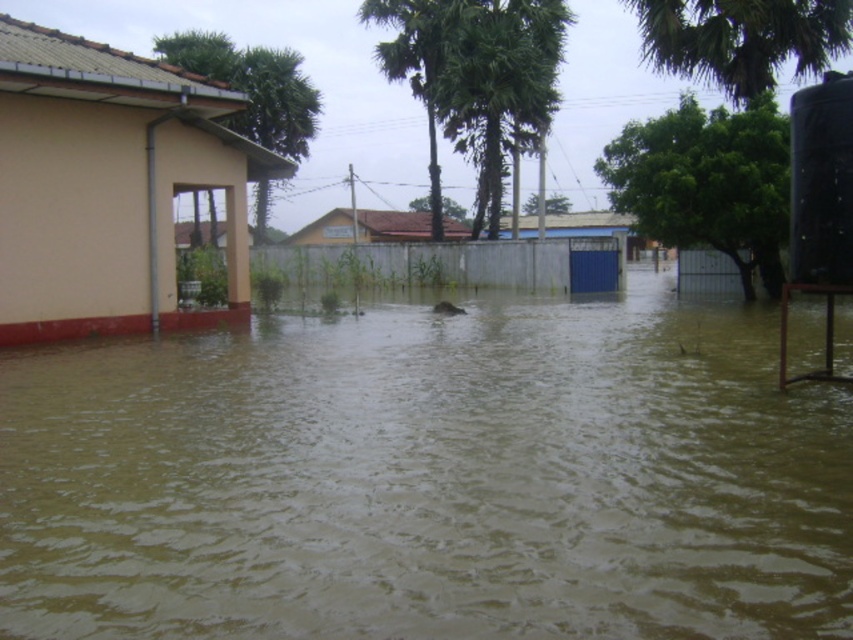
Who is higher up, black matte water tank at right or green leafy palm tree at upper left?

green leafy palm tree at upper left is higher up.

In the scene shown: Is black matte water tank at right above green leafy palm tree at upper left?

No, black matte water tank at right is not above green leafy palm tree at upper left.

Measure the distance between point (834, 220) and camera.

A distance of 9.36 meters exists between point (834, 220) and camera.

Image resolution: width=853 pixels, height=640 pixels. Find the location of `black matte water tank at right`. black matte water tank at right is located at coordinates (821, 180).

Can you confirm if green leafy palm tree at upper center is positioned above black matte water tank at right?

Yes.

Which is behind, point (410, 45) or point (828, 145)?

Positioned behind is point (410, 45).

Locate an element on the screen. The height and width of the screenshot is (640, 853). green leafy palm tree at upper center is located at coordinates (474, 77).

Who is higher up, brown murky water at center or black matte water tank at right?

Positioned higher is black matte water tank at right.

Is point (401, 330) positioned after point (834, 196)?

Yes.

Find the location of a particular element. Image resolution: width=853 pixels, height=640 pixels. brown murky water at center is located at coordinates (428, 480).